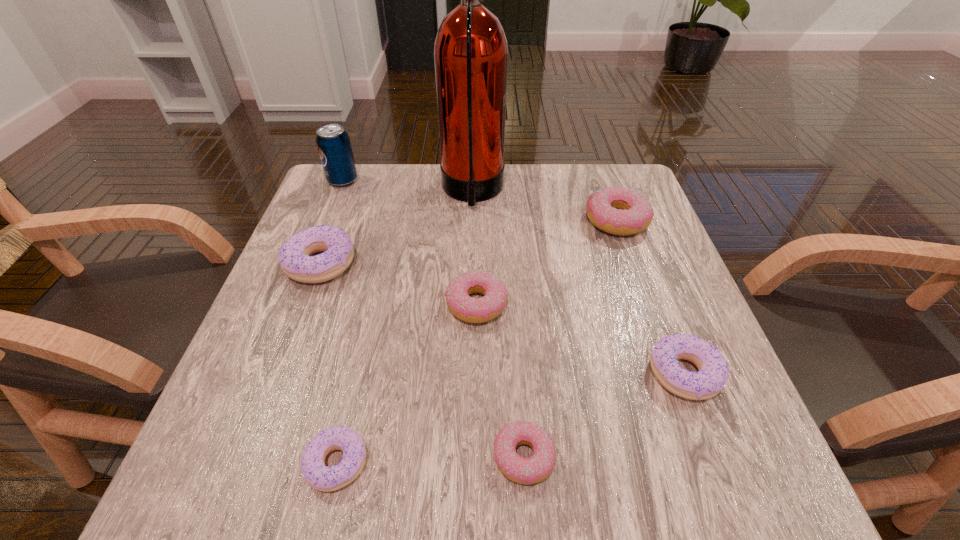
Identify the location of vacant area that lies between the red fire extinguisher and the biggest pink doughnut. (544, 206).

Locate an element on the screen. free space between the tallest object and the second nearest pink doughnut is located at coordinates (474, 248).

Where is `vacant region between the smallest pink doughnut and the seventh shortest object`? The image size is (960, 540). vacant region between the smallest pink doughnut and the seventh shortest object is located at coordinates (433, 319).

Locate an element on the screen. This screenshot has width=960, height=540. vacant point located between the red fire extinguisher and the second smallest pink doughnut is located at coordinates (474, 248).

Identify the location of object that is the sixth closest one to the leftmost doughnut. This screenshot has width=960, height=540. (622, 211).

This screenshot has height=540, width=960. I want to click on the fourth closest object relative to the second doughnut from left to right, so click(713, 373).

Where is `the third closest doughnut to the nearest pink doughnut`? The width and height of the screenshot is (960, 540). the third closest doughnut to the nearest pink doughnut is located at coordinates (472, 310).

Locate an element on the screen. This screenshot has width=960, height=540. doughnut object that ranks as the fourth closest to the fire extinguisher is located at coordinates (713, 373).

Identify which pink doughnut is located as the second nearest to the rightmost purple doughnut. Please provide its 2D coordinates. Your answer should be formatted as a tuple, i.e. [(x, y)], where the tuple contains the x and y coordinates of a point satisfying the conditions above.

[(472, 310)]

Choose which pink doughnut is the second nearest neighbor to the fifth doughnut from right to left. Please provide its 2D coordinates. Your answer should be formatted as a tuple, i.e. [(x, y)], where the tuple contains the x and y coordinates of a point satisfying the conditions above.

[(472, 310)]